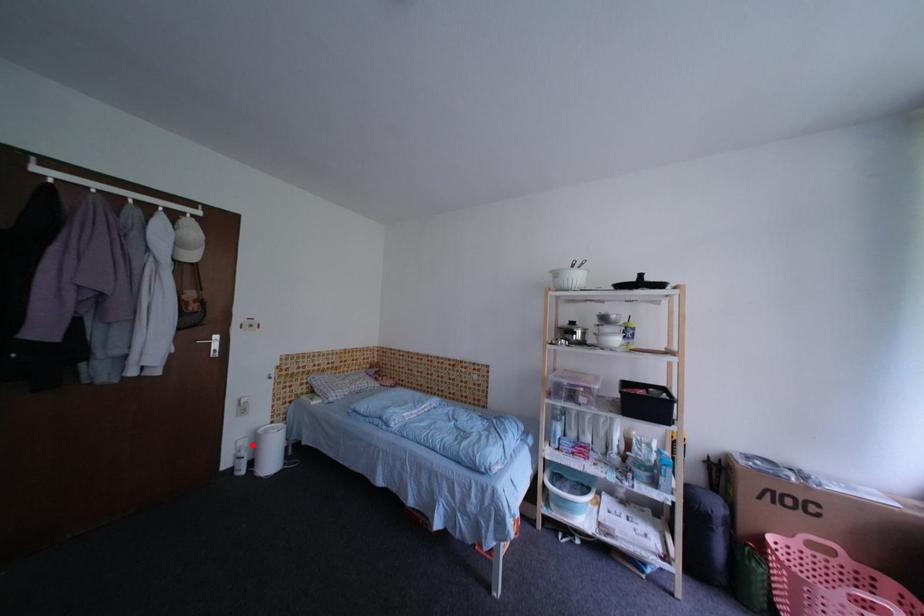
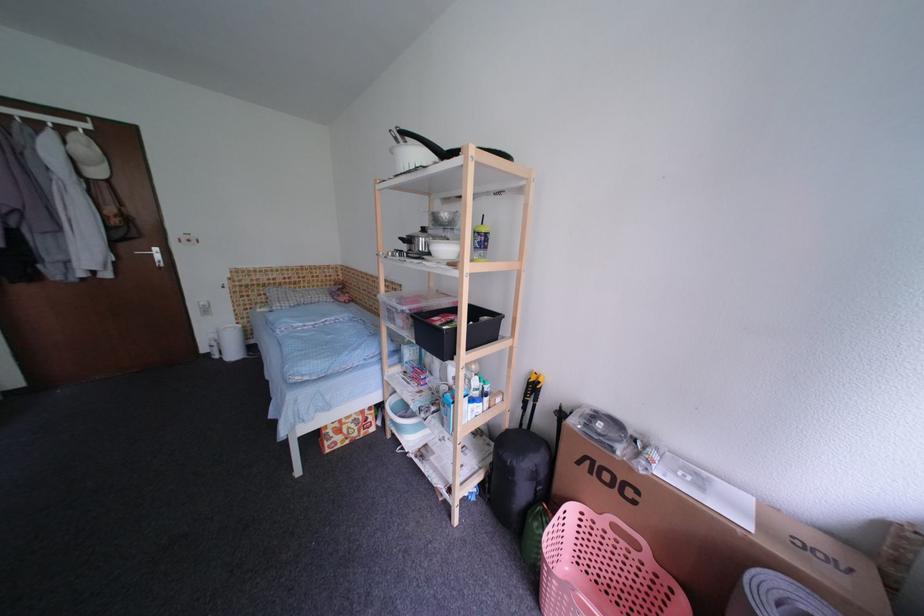
Locate, in the second image, the point that corresponds to the highlighted location in the first image.

(222, 338)